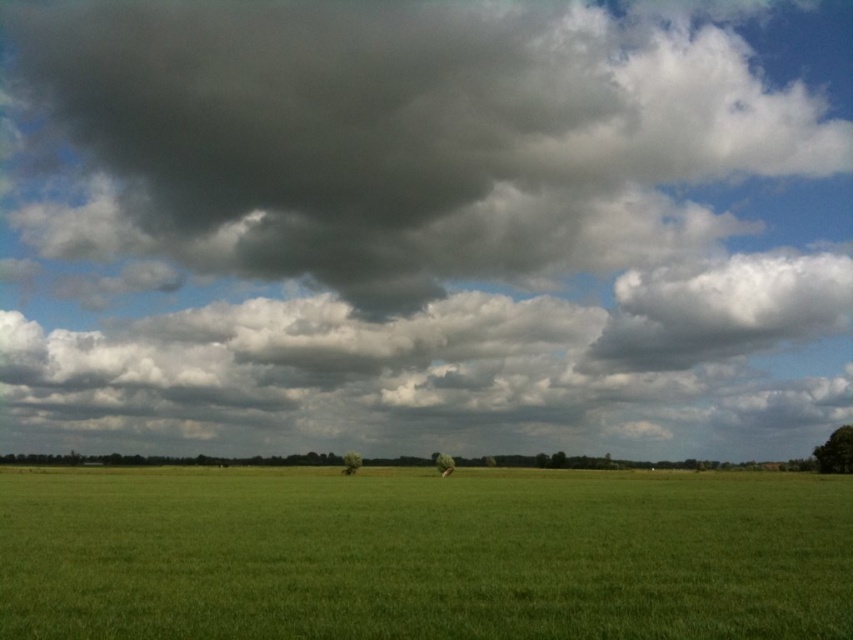
You are standing in the open field and looking towards the horizon. Which object, the green grass at center or the white fluffy cloud at upper right, is closer to you?

The green grass at center is closer to you because it is in front of the white fluffy cloud at upper right.